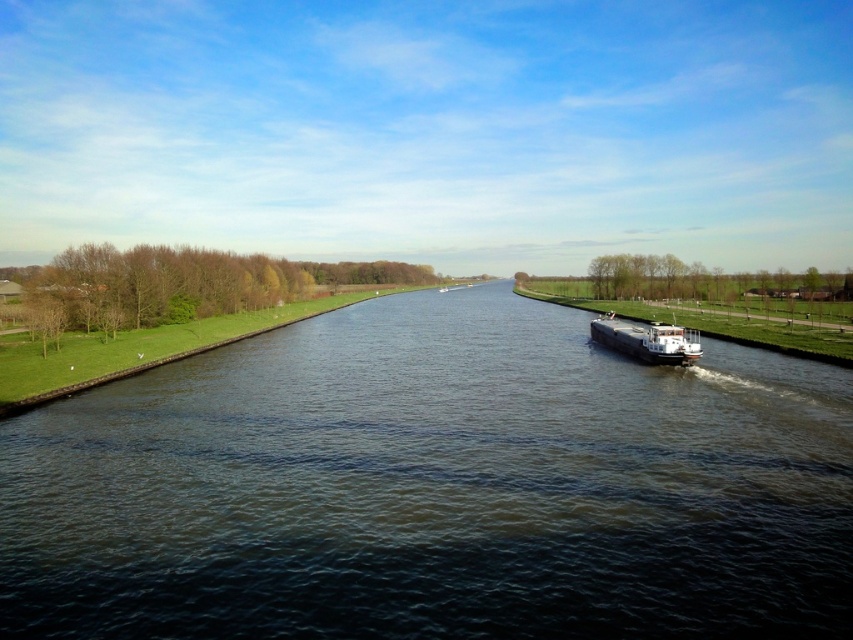
Question: Does dark blue water at center appear on the right side of white glossy barge at center?

Choices:
 (A) yes
 (B) no

Answer: (B)

Question: Can you confirm if dark blue water at center is thinner than white glossy barge at center?

Choices:
 (A) yes
 (B) no

Answer: (B)

Question: Can you confirm if dark blue water at center is smaller than white glossy barge at center?

Choices:
 (A) yes
 (B) no

Answer: (B)

Question: Which point is farther to the camera?

Choices:
 (A) tap(592, 412)
 (B) tap(624, 342)

Answer: (B)

Question: Which point appears closest to the camera in this image?

Choices:
 (A) (628, 339)
 (B) (585, 378)

Answer: (B)